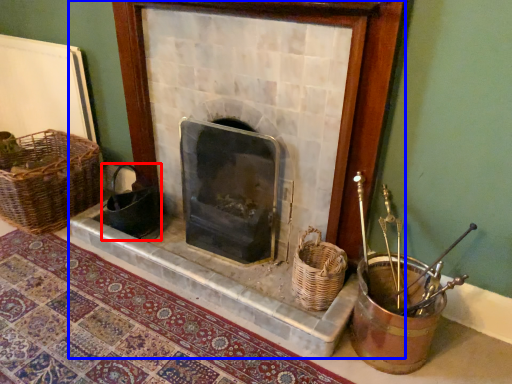
Question: Among these objects, which one is farthest to the camera, gift basket (highlighted by a red box) or fireplace (highlighted by a blue box)?

Choices:
 (A) gift basket
 (B) fireplace

Answer: (A)